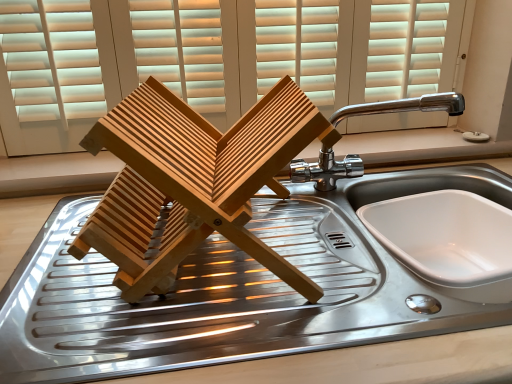
Question: Does wooden blinds at upper center have a larger size compared to white glossy sink at lower right?

Choices:
 (A) no
 (B) yes

Answer: (B)

Question: Is wooden blinds at upper center closer to camera compared to white glossy sink at lower right?

Choices:
 (A) yes
 (B) no

Answer: (B)

Question: Considering the relative positions of wooden blinds at upper center and white glossy sink at lower right in the image provided, is wooden blinds at upper center to the right of white glossy sink at lower right from the viewer's perspective?

Choices:
 (A) yes
 (B) no

Answer: (B)

Question: Is wooden blinds at upper center wider than white glossy sink at lower right?

Choices:
 (A) yes
 (B) no

Answer: (B)

Question: From the image's perspective, does wooden blinds at upper center appear higher than white glossy sink at lower right?

Choices:
 (A) no
 (B) yes

Answer: (B)

Question: Considering the relative positions of white glossy sink at lower right and chrome metallic faucet at upper right in the image provided, is white glossy sink at lower right to the left or to the right of chrome metallic faucet at upper right?

Choices:
 (A) right
 (B) left

Answer: (A)

Question: In terms of size, does white glossy sink at lower right appear bigger or smaller than chrome metallic faucet at upper right?

Choices:
 (A) small
 (B) big

Answer: (B)

Question: Considering the positions of point (497, 269) and point (385, 107), is point (497, 269) closer or farther from the camera than point (385, 107)?

Choices:
 (A) closer
 (B) farther

Answer: (A)

Question: Do you think white glossy sink at lower right is within chrome metallic faucet at upper right, or outside of it?

Choices:
 (A) outside
 (B) inside

Answer: (A)

Question: Would you say wooden blinds at upper center is to the left or to the right of chrome metallic faucet at upper right in the picture?

Choices:
 (A) left
 (B) right

Answer: (A)

Question: Is wooden blinds at upper center in front of or behind chrome metallic faucet at upper right in the image?

Choices:
 (A) behind
 (B) front

Answer: (A)

Question: In terms of size, does wooden blinds at upper center appear bigger or smaller than chrome metallic faucet at upper right?

Choices:
 (A) big
 (B) small

Answer: (A)

Question: From a real-world perspective, is wooden blinds at upper center above or below chrome metallic faucet at upper right?

Choices:
 (A) above
 (B) below

Answer: (A)

Question: Which is correct: wooden blinds at upper center is inside white glossy sink at lower right, or outside of it?

Choices:
 (A) outside
 (B) inside

Answer: (A)

Question: Is point (86, 77) closer or farther from the camera than point (494, 205)?

Choices:
 (A) closer
 (B) farther

Answer: (B)